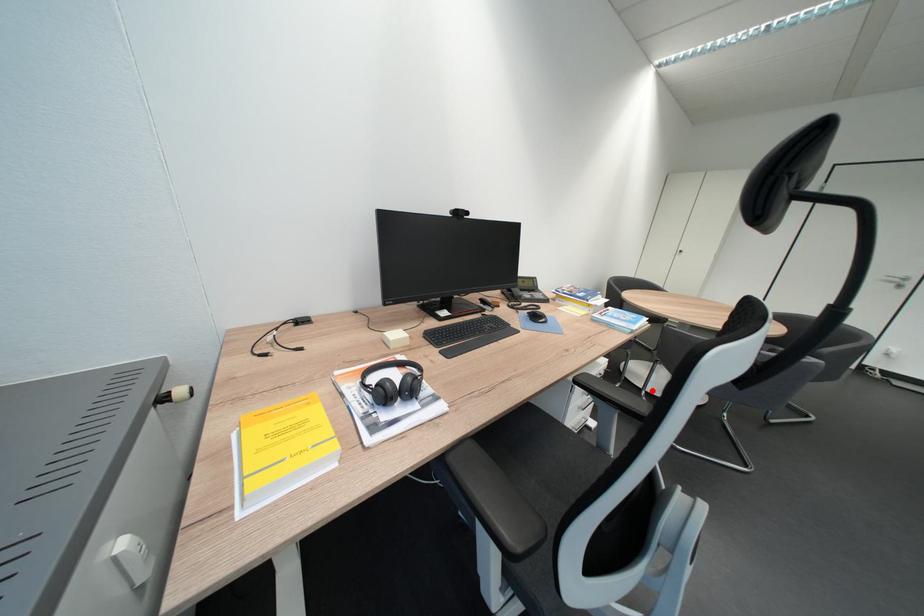
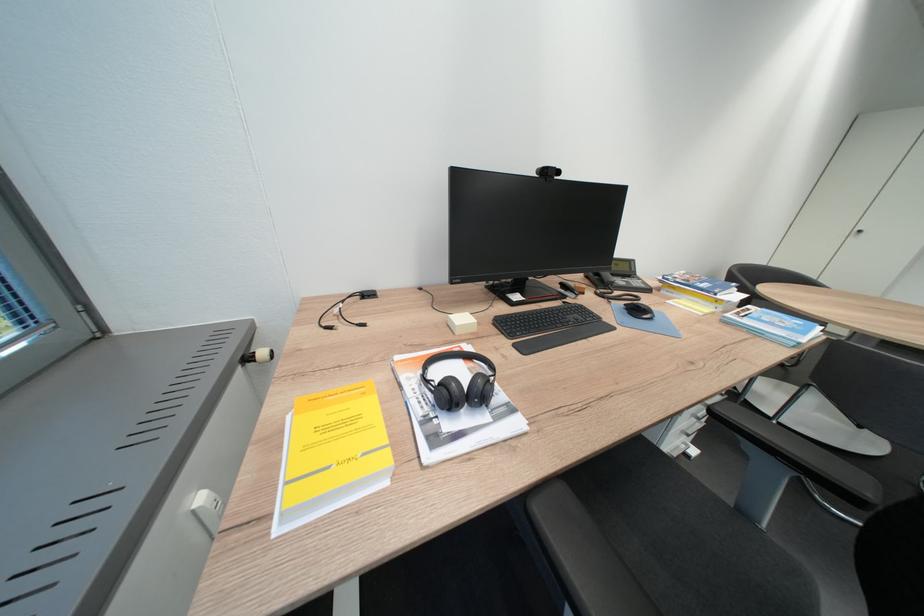
Find the pixel in the second image that matches the highlighted location in the first image.

(781, 419)